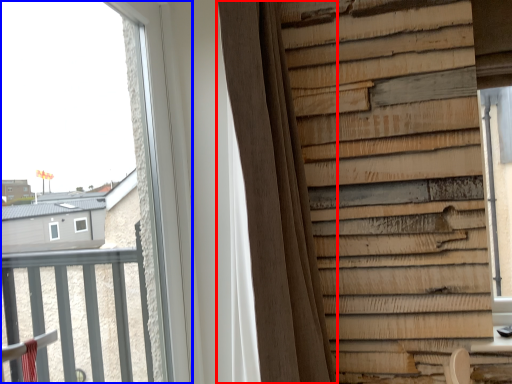
Question: Which point is closer to the camera, curtain (highlighted by a red box) or window (highlighted by a blue box)?

Choices:
 (A) curtain
 (B) window

Answer: (B)